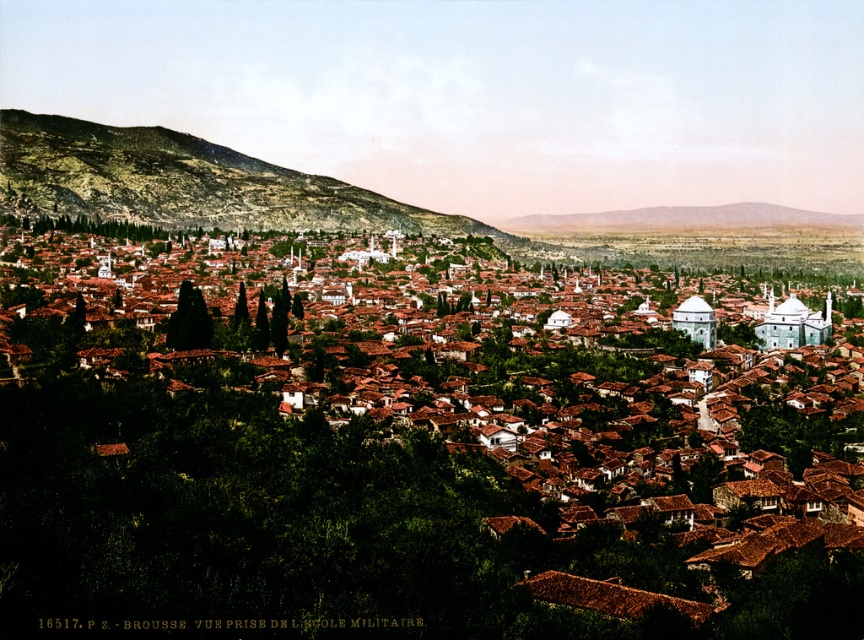
Locate an element on the screen. brown clay rooftops at center is located at coordinates (396, 470).

Image resolution: width=864 pixels, height=640 pixels. Find the location of `brown clay rooftops at center`. brown clay rooftops at center is located at coordinates (396, 470).